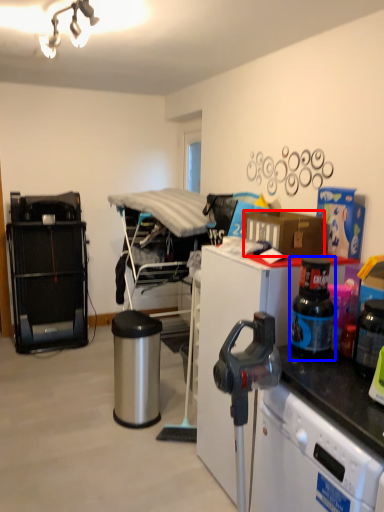
Question: Which point is closer to the camera, box (highlighted by a red box) or bottle (highlighted by a blue box)?

Choices:
 (A) box
 (B) bottle

Answer: (B)